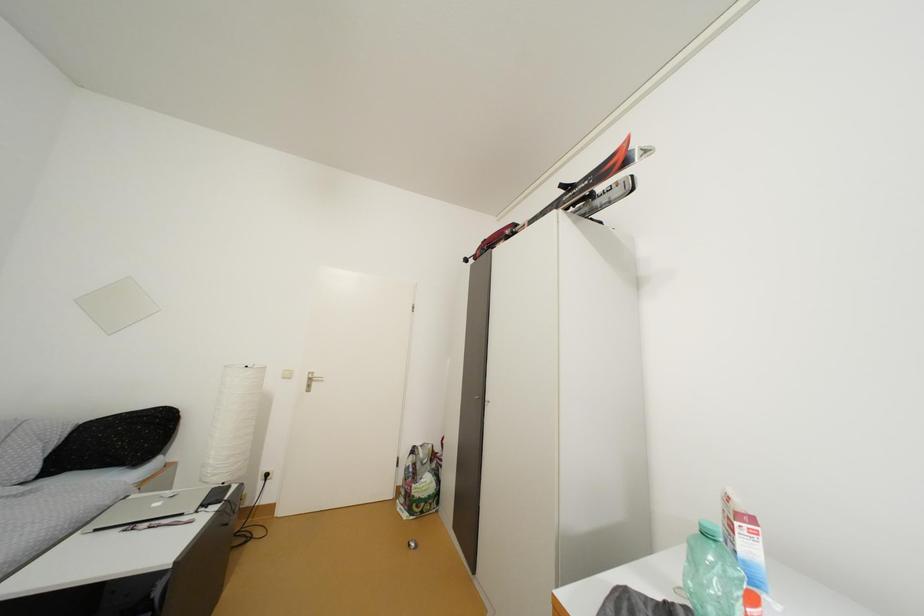
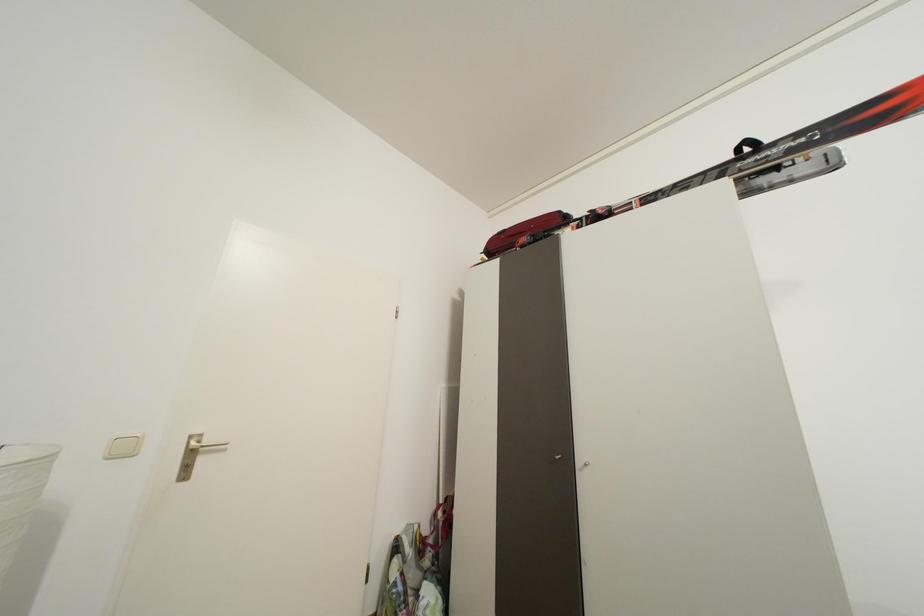
The images are taken continuously from a first-person perspective. In which direction are you moving?

The cameraman moved toward left, forward.